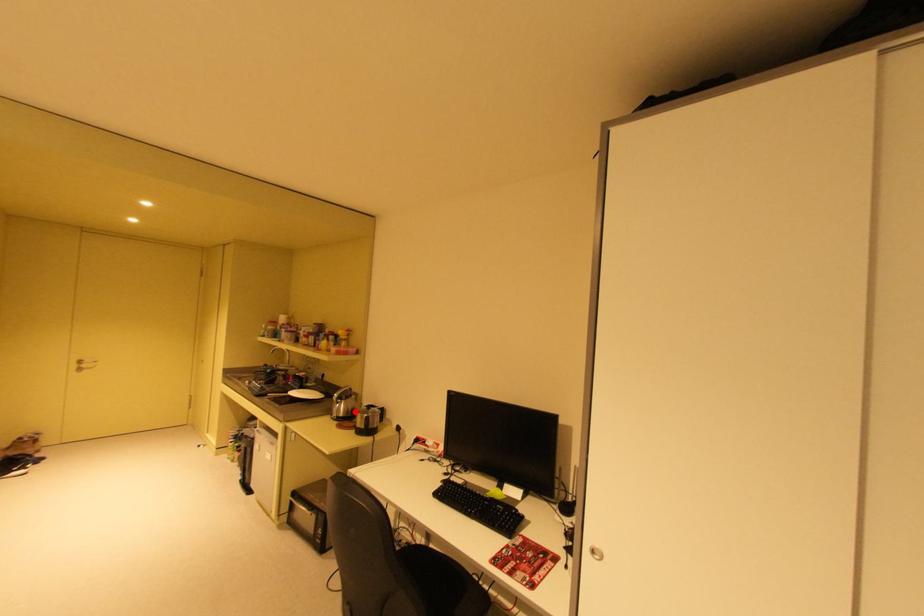
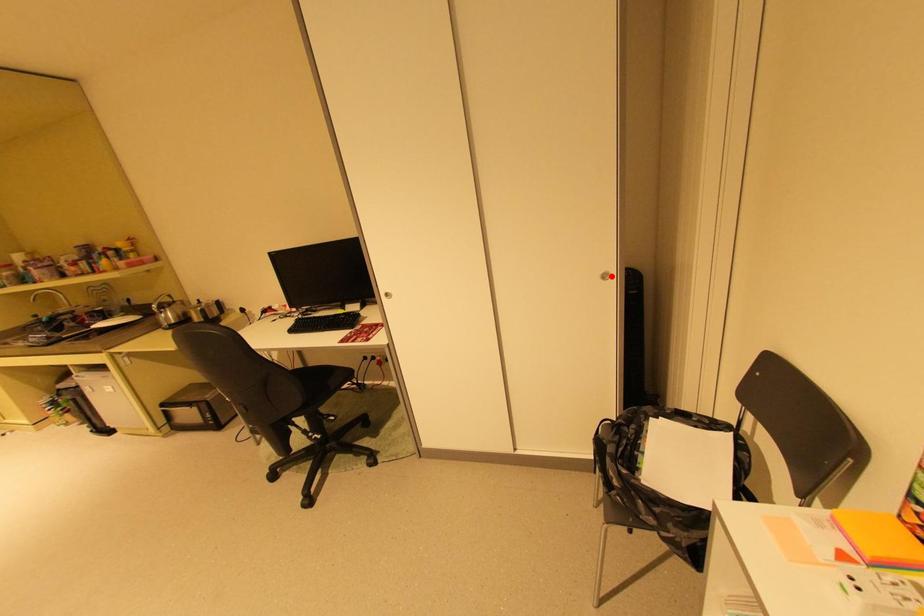
I am providing you with two images of the same scene from different viewpoints. A red point is marked on the first image and another point is marked on the second image. Are the points marked in image1 and image2 representing the same 3D position?

No